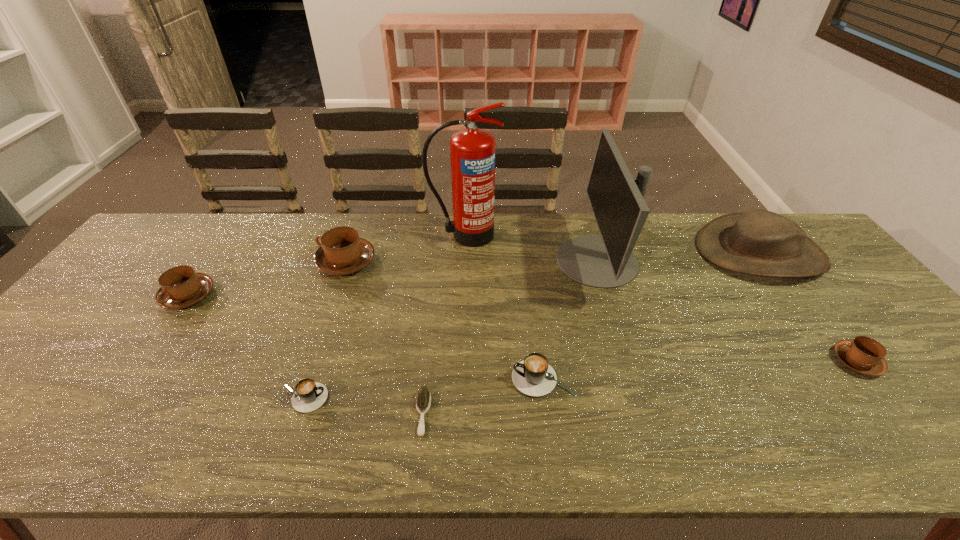
Find the location of a particular element. the fourth object from right to left is located at coordinates (533, 376).

Locate an element on the screen. The image size is (960, 540). the fourth cappuccino from left to right is located at coordinates (533, 376).

The height and width of the screenshot is (540, 960). What are the coordinates of `the smallest brown cappuccino` in the screenshot? It's located at (864, 355).

Image resolution: width=960 pixels, height=540 pixels. In order to click on the rightmost cappuccino in this screenshot , I will do `click(864, 355)`.

Locate an element on the screen. The width and height of the screenshot is (960, 540). the shortest cappuccino is located at coordinates (309, 395).

I want to click on the second shortest object, so click(309, 395).

You are a GUI agent. You are given a task and a screenshot of the screen. Output one action in this format:
    pyautogui.click(x=<x>, y=<y>)
    Task: Click on the shortest object
    The height and width of the screenshot is (540, 960).
    Given the screenshot: What is the action you would take?
    pyautogui.click(x=423, y=401)

Identify the location of vacant space located 0.100m on the surface of the fire extinguisher. (463, 268).

Identify the location of vacant space situated on the screen of the seventh object from left to right. (443, 261).

In order to click on free spot located 0.150m on the screen of the seventh object from left to right in this screenshot , I will do `click(508, 261)`.